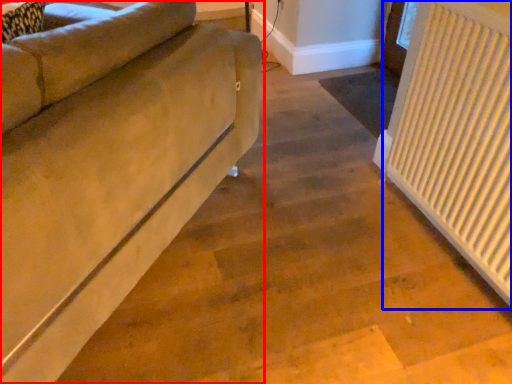
Question: Which object appears farthest to the camera in this image, studio couch (highlighted by a red box) or radiator (highlighted by a blue box)?

Choices:
 (A) studio couch
 (B) radiator

Answer: (B)